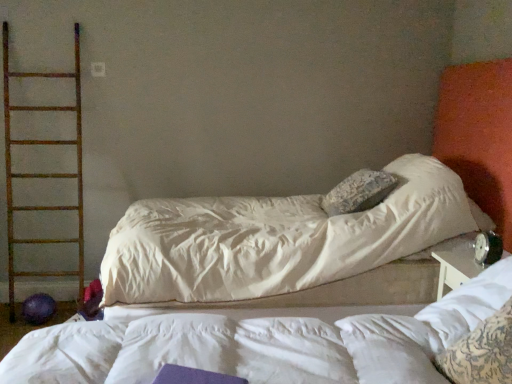
Question: Can you confirm if black plastic alarm clock at right is positioned to the right of rusty metal ladder at left?

Choices:
 (A) yes
 (B) no

Answer: (A)

Question: From the image's perspective, is black plastic alarm clock at right beneath rusty metal ladder at left?

Choices:
 (A) yes
 (B) no

Answer: (A)

Question: Considering the relative sizes of black plastic alarm clock at right and rusty metal ladder at left in the image provided, is black plastic alarm clock at right taller than rusty metal ladder at left?

Choices:
 (A) yes
 (B) no

Answer: (B)

Question: Does black plastic alarm clock at right have a lesser height compared to rusty metal ladder at left?

Choices:
 (A) no
 (B) yes

Answer: (B)

Question: Is rusty metal ladder at left located within black plastic alarm clock at right?

Choices:
 (A) no
 (B) yes

Answer: (A)

Question: Is black plastic alarm clock at right facing away from rusty metal ladder at left?

Choices:
 (A) yes
 (B) no

Answer: (B)

Question: Are rusty metal ladder at left and black plastic alarm clock at right making contact?

Choices:
 (A) no
 (B) yes

Answer: (A)

Question: Does rusty metal ladder at left lie in front of black plastic alarm clock at right?

Choices:
 (A) no
 (B) yes

Answer: (A)

Question: From a real-world perspective, is rusty metal ladder at left on black plastic alarm clock at right?

Choices:
 (A) no
 (B) yes

Answer: (B)

Question: Is rusty metal ladder at left positioned far away from black plastic alarm clock at right?

Choices:
 (A) yes
 (B) no

Answer: (A)

Question: Considering the relative sizes of rusty metal ladder at left and black plastic alarm clock at right in the image provided, is rusty metal ladder at left bigger than black plastic alarm clock at right?

Choices:
 (A) yes
 (B) no

Answer: (A)

Question: From the image's perspective, is rusty metal ladder at left under black plastic alarm clock at right?

Choices:
 (A) no
 (B) yes

Answer: (A)

Question: From the image's perspective, is black plastic alarm clock at right above white textured pillow at right?

Choices:
 (A) no
 (B) yes

Answer: (B)